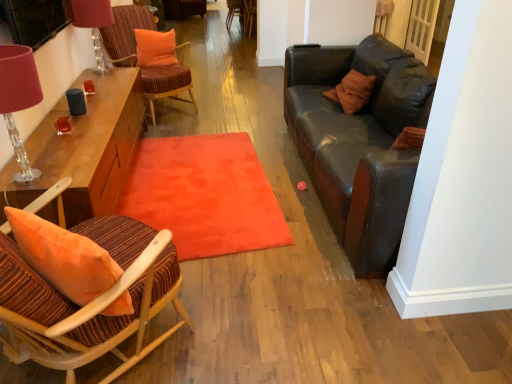
Describe the element at coordinates (18, 98) in the screenshot. The image size is (512, 384). I see `matte pink lampshade at left, the 2th table lamp in the top-to-bottom sequence` at that location.

This screenshot has width=512, height=384. I want to click on matte pink lampshade at left, the second table lamp in the back-to-front sequence, so [x=18, y=98].

The image size is (512, 384). What do you see at coordinates (249, 16) in the screenshot?
I see `wooden armchair at center, which is the 2th armchair from left to right` at bounding box center [249, 16].

You are a GUI agent. You are given a task and a screenshot of the screen. Output one action in this format:
    pyautogui.click(x=<x>, y=<y>)
    Task: Click on the wooden chair at center, placed as the 3th chair when sorted from front to back
    
    Given the screenshot: What is the action you would take?
    pyautogui.click(x=242, y=14)

Locate an element on the screen. striped fabric chair at left, positioned as the third chair in top-to-bottom order is located at coordinates (92, 301).

From a real-world perspective, is striped fabric chair at left, positioned as the third chair in top-to-bottom order, over velvet orange chair at upper left, the second chair viewed from the top?

Yes, from a real-world perspective, striped fabric chair at left, positioned as the third chair in top-to-bottom order, is above velvet orange chair at upper left, the second chair viewed from the top.

Is striped fabric chair at left, positioned as the third chair in top-to-bottom order, spatially inside velvet orange chair at upper left, the second chair viewed from the top, or outside of it?

striped fabric chair at left, positioned as the third chair in top-to-bottom order, lies outside velvet orange chair at upper left, the second chair viewed from the top.

In the image, there is a velvet orange chair at upper left, the second chair viewed from the top. Where is `chair below it (from the image's perspective)`? Image resolution: width=512 pixels, height=384 pixels. chair below it (from the image's perspective) is located at coordinates (92, 301).

Based on the photo, are striped fabric chair at left, the first chair positioned from the front, and velvet orange chair at upper left, the second chair positioned from the front, making contact?

No, striped fabric chair at left, the first chair positioned from the front, is not with velvet orange chair at upper left, the second chair positioned from the front.

From the image's perspective, relative to wooden chair at center, which is the 1th chair in top-to-bottom order, is orange fabric pillow at upper center above or below?

orange fabric pillow at upper center is situated lower than wooden chair at center, which is the 1th chair in top-to-bottom order, in the image.

Between orange fabric pillow at upper center and wooden chair at center, the 3th chair in the bottom-to-top sequence, which one has smaller width?

orange fabric pillow at upper center is thinner.

What's the angular difference between orange fabric pillow at upper center and wooden chair at center, placed as the 3th chair when sorted from front to back,'s facing directions?

21.2 degrees.

Does orange fabric pillow at upper center have a greater height compared to wooden chair at center, which is the 1th chair in top-to-bottom order?

No.

Is wooden armchair at center, acting as the second armchair starting from the right, at the back of matte pink lampshade at left, the first table lamp positioned from the front?

No, matte pink lampshade at left, the first table lamp positioned from the front,'s orientation is not away from wooden armchair at center, acting as the second armchair starting from the right.

From a real-world perspective, is matte pink lampshade at left, the second table lamp in the back-to-front sequence, physically located above or below wooden armchair at center, acting as the second armchair starting from the right?

matte pink lampshade at left, the second table lamp in the back-to-front sequence, is above wooden armchair at center, acting as the second armchair starting from the right.

From the image's perspective, who appears lower, matte pink lampshade at left, the second table lamp in the back-to-front sequence, or wooden armchair at center, acting as the second armchair starting from the right?

From the image's view, matte pink lampshade at left, the second table lamp in the back-to-front sequence, is below.

Which is closer to the camera, (18, 141) or (232, 8)?

Point (18, 141) is closer to the camera than point (232, 8).

Is striped fabric chair at left, the first chair positioned from the front, surrounded by wooden armchair at center, arranged as the first armchair when viewed from the left?

No, wooden armchair at center, arranged as the first armchair when viewed from the left, does not contain striped fabric chair at left, the first chair positioned from the front.

Is the position of wooden armchair at center, acting as the second armchair starting from the right, less distant than that of striped fabric chair at left, which ranks as the 1th chair in bottom-to-top order?

No, it is behind striped fabric chair at left, which ranks as the 1th chair in bottom-to-top order.

How distant is wooden armchair at center, arranged as the first armchair when viewed from the left, from striped fabric chair at left, the first chair positioned from the front?

6.02 meters.

Is velvet orange rug at center smaller than matte pink lampshade at left, the second table lamp in the back-to-front sequence?

Actually, velvet orange rug at center might be larger than matte pink lampshade at left, the second table lamp in the back-to-front sequence.

Does point (189, 231) come farther from viewer compared to point (21, 59)?

Yes, point (189, 231) is farther from viewer.

Is velvet orange rug at center outside of matte pink lampshade at left, the second table lamp in the back-to-front sequence?

velvet orange rug at center is positioned outside matte pink lampshade at left, the second table lamp in the back-to-front sequence.

Considering the sizes of velvet orange rug at center and matte pink lampshade at left, the first table lamp positioned from the front, in the image, is velvet orange rug at center wider or thinner than matte pink lampshade at left, the first table lamp positioned from the front,?

Clearly, velvet orange rug at center has more width compared to matte pink lampshade at left, the first table lamp positioned from the front.

Relative to wooden armchair at center, acting as the second armchair starting from the right, is striped fabric chair at left, the 3th chair when ordered from back to front, in front or behind?

Visually, striped fabric chair at left, the 3th chair when ordered from back to front, is located in front of wooden armchair at center, acting as the second armchair starting from the right.

Who is bigger, striped fabric chair at left, the 3th chair when ordered from back to front, or wooden armchair at center, arranged as the first armchair when viewed from the left?

wooden armchair at center, arranged as the first armchair when viewed from the left.

Considering the positions of objects striped fabric chair at left, positioned as the third chair in top-to-bottom order, and wooden armchair at center, acting as the second armchair starting from the right, in the image provided, who is more to the left, striped fabric chair at left, positioned as the third chair in top-to-bottom order, or wooden armchair at center, acting as the second armchair starting from the right,?

Positioned to the left is striped fabric chair at left, positioned as the third chair in top-to-bottom order.

In terms of width, does striped fabric chair at left, the first chair positioned from the front, look wider or thinner when compared to wooden armchair at center, acting as the second armchair starting from the right?

Considering their sizes, striped fabric chair at left, the first chair positioned from the front, looks slimmer than wooden armchair at center, acting as the second armchair starting from the right.

Considering the relative sizes of wooden armchair at center, positioned as the first armchair in right-to-left order, and wooden chair at center, which is the 1th chair in top-to-bottom order, in the image provided, is wooden armchair at center, positioned as the first armchair in right-to-left order, taller than wooden chair at center, which is the 1th chair in top-to-bottom order,?

Yes.

Which is closer to the camera, (247, 11) or (244, 9)?

The point (247, 11) is closer.

Can wooden chair at center, the 1th chair positioned from the back, be found inside wooden armchair at center, which is the 2th armchair from left to right?

No.

You are a GUI agent. You are given a task and a screenshot of the screen. Output one action in this format:
    pyautogui.click(x=<x>, y=<y>)
    Task: Click on the chair above the wooden armchair at center, which is the 2th armchair from left to right (from the image's perspective)
    
    Given the screenshot: What is the action you would take?
    pyautogui.click(x=242, y=14)

Image resolution: width=512 pixels, height=384 pixels. I want to click on chair lying below the velvet orange chair at upper left, positioned as the second chair in bottom-to-top order (from the image's perspective), so click(x=92, y=301).

Find the location of a particular element. The height and width of the screenshot is (384, 512). chair that is the 2nd object directly below the orange fabric pillow at upper center (from a real-world perspective) is located at coordinates (242, 14).

From the image, which object appears to be farther from wooden chair at center, the 1th chair positioned from the back, wooden armchair at center, which is the 2th armchair from left to right, or velvet orange rug at center?

velvet orange rug at center is further to wooden chair at center, the 1th chair positioned from the back.

Estimate the real-world distances between objects in this image. Which object is closer to striped fabric chair at left, positioned as the third chair in top-to-bottom order, matte pink lampshade at upper left, which appears as the second table lamp when ordered from the bottom, or orange fabric pillow at upper center?

The object closer to striped fabric chair at left, positioned as the third chair in top-to-bottom order, is matte pink lampshade at upper left, which appears as the second table lamp when ordered from the bottom.

In the scene shown: Looking at the image, which one is located further to wooden chair at center, placed as the 3th chair when sorted from front to back, wooden armchair at center, arranged as the first armchair when viewed from the left, or striped fabric chair at left, the 3th chair when ordered from back to front?

Among the two, striped fabric chair at left, the 3th chair when ordered from back to front, is located further to wooden chair at center, placed as the 3th chair when sorted from front to back.

Based on the photo, when comparing their distances from wooden armchair at center, acting as the second armchair starting from the right, does wooden armchair at center, positioned as the first armchair in right-to-left order, or wooden chair at center, placed as the 3th chair when sorted from front to back, seem closer?

wooden chair at center, placed as the 3th chair when sorted from front to back, is positioned closer to the anchor wooden armchair at center, acting as the second armchair starting from the right.

Looking at the image, which one is located closer to wooden armchair at center, which is the 2th armchair from left to right, orange fabric pillow at upper center or matte pink lampshade at left, which ranks as the first table lamp in bottom-to-top order?

orange fabric pillow at upper center lies closer to wooden armchair at center, which is the 2th armchair from left to right, than the other object.

When comparing their distances from striped fabric chair at left, positioned as the third chair in top-to-bottom order, does wooden armchair at center, positioned as the first armchair in right-to-left order, or wooden armchair at center, arranged as the first armchair when viewed from the left, seem further?

The object further to striped fabric chair at left, positioned as the third chair in top-to-bottom order, is wooden armchair at center, arranged as the first armchair when viewed from the left.

Looking at this image, considering their positions, is velvet orange chair at upper left, positioned as the second chair in bottom-to-top order, positioned further to orange fabric pillow at upper center than wooden chair at center, which is the 1th chair in top-to-bottom order?

wooden chair at center, which is the 1th chair in top-to-bottom order, is positioned further to the anchor orange fabric pillow at upper center.

Which object lies nearer to the anchor point velvet orange chair at upper left, the second chair viewed from the top, striped fabric chair at left, the first chair positioned from the front, or wooden chair at center, which is the 1th chair in top-to-bottom order?

striped fabric chair at left, the first chair positioned from the front, lies closer to velvet orange chair at upper left, the second chair viewed from the top, than the other object.

Locate an element on the screen. table lamp positioned between velvet orange rug at center and orange fabric pillow at upper center from near to far is located at coordinates (93, 23).

This screenshot has width=512, height=384. I want to click on mat located between striped fabric chair at left, which ranks as the 1th chair in bottom-to-top order, and matte pink lampshade at upper left, the 1th table lamp positioned from the top, in the depth direction, so click(205, 195).

Where is `pillow between striped fabric chair at left, which ranks as the 1th chair in bottom-to-top order, and wooden armchair at center, arranged as the first armchair when viewed from the left, along the z-axis`? The height and width of the screenshot is (384, 512). pillow between striped fabric chair at left, which ranks as the 1th chair in bottom-to-top order, and wooden armchair at center, arranged as the first armchair when viewed from the left, along the z-axis is located at coordinates (155, 48).

At what (x,y) coordinates should I click in order to perform the action: click on table lamp between velvet orange rug at center and wooden chair at center, which is the 1th chair in top-to-bottom order, from front to back. Please return your answer as a coordinate pair (x, y). Looking at the image, I should click on (93, 23).